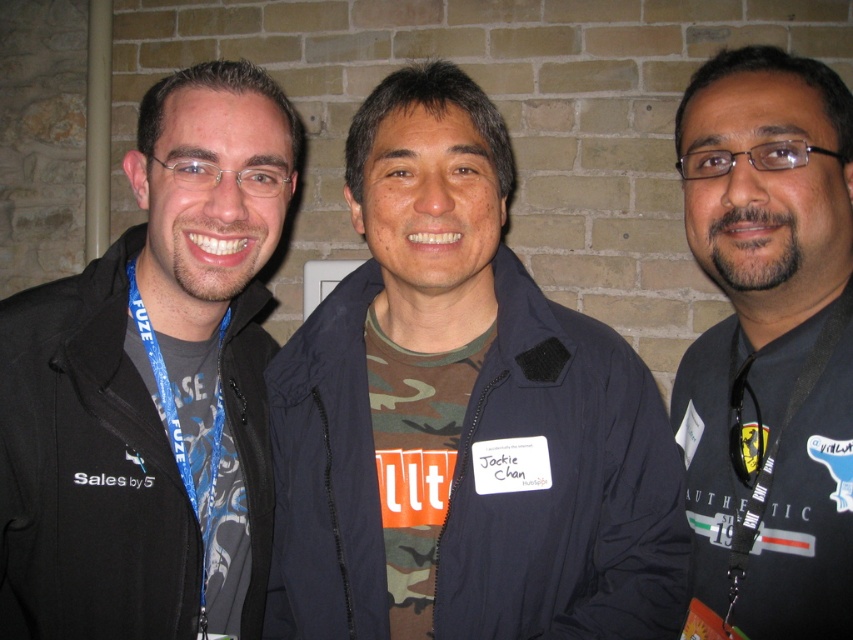
From the picture: You are standing in front of the three people in the image. There are two points marked on the brick wall behind them. One is at coordinates point (635, 552) and the other at point (721, 593). Which of these points is nearer to you?

Point (635, 552) is closer to the viewer than point (721, 593).

You are a photographer trying to capture a closeup of the black fabric shirt at center and the black fabric lanyard at right. Which object should you zoom in on to ensure both are in focus without moving the camera?

The black fabric lanyard at right is narrower than the black fabric shirt at center, so you should zoom in on the black fabric shirt at center to ensure both are in focus without moving the camera.